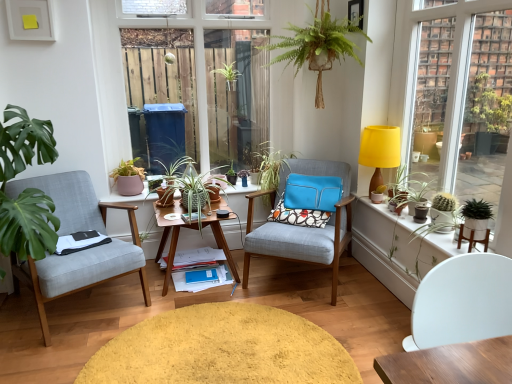
Where is `vacant space in textured fabric armchair at center, which ranks as the 2th chair in right-to-left order (from a real-world perspective)`? vacant space in textured fabric armchair at center, which ranks as the 2th chair in right-to-left order (from a real-world perspective) is located at coordinates (297, 277).